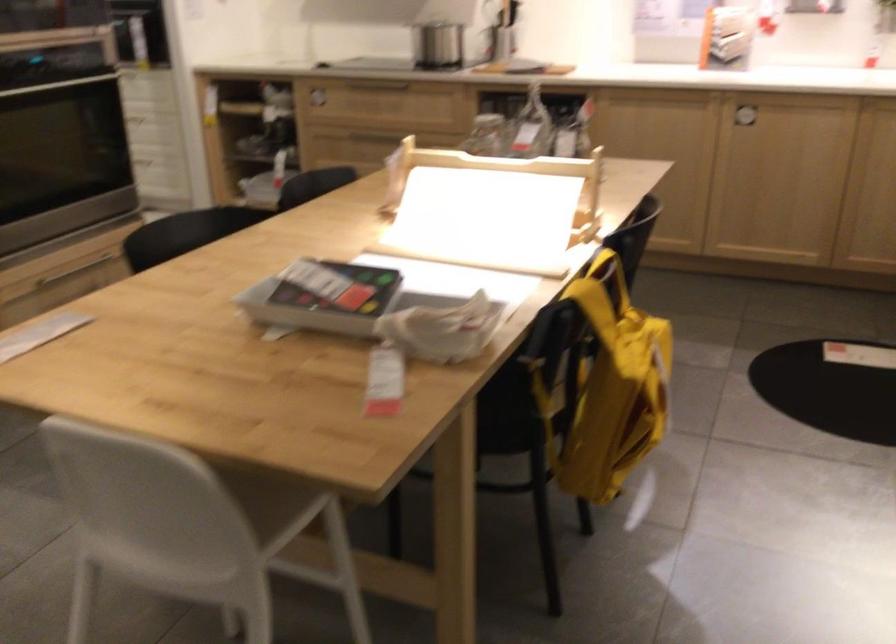
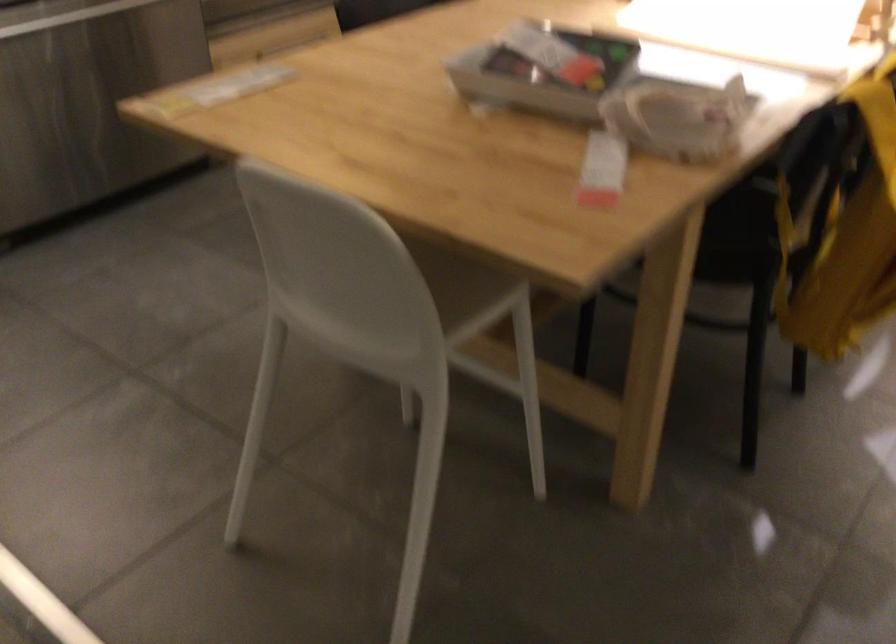
Question: How did the camera likely rotate?

Choices:
 (A) Left
 (B) Right
 (C) Up
 (D) Down

Answer: (A)